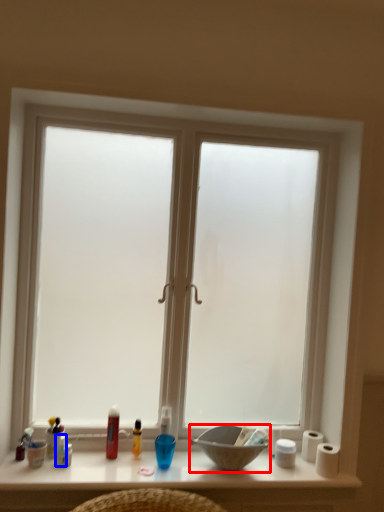
Question: Which point is closer to the camera, bowl (highlighted by a red box) or toiletry (highlighted by a blue box)?

Choices:
 (A) bowl
 (B) toiletry

Answer: (A)